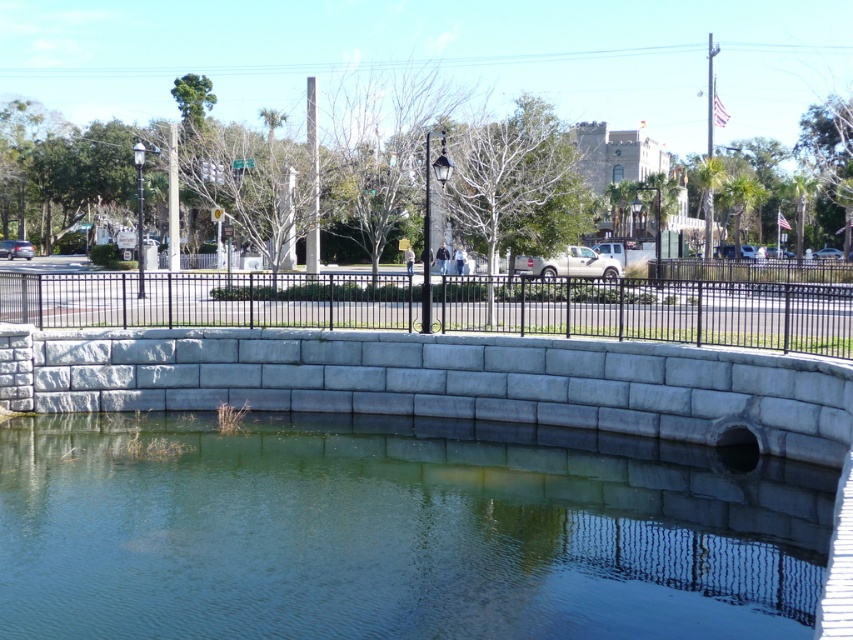
You are a maintenance worker needing to cross from the gray concrete pool at center to the black metal fence at center. The path between them is 7.00 meters wide. Can you walk directly between them without any obstacles?

The distance between the gray concrete pool at center and the black metal fence at center is 7.00 meters. Since there are no mentioned obstacles in the scene description, you can walk directly between them.

You are standing at the point with coordinates point (91, 321) and want to walk towards the point (636, 577). According to the scene, will you first encounter the stone wall or the black metal fence?

You will first encounter the black metal fence because point (636, 577) is in front of point (91, 321), meaning the path leads towards the fence before reaching the stone wall.